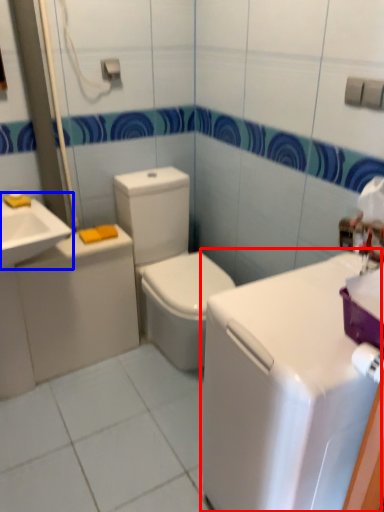
Question: Which object appears closest to the camera in this image, counter top (highlighted by a red box) or sink (highlighted by a blue box)?

Choices:
 (A) counter top
 (B) sink

Answer: (A)